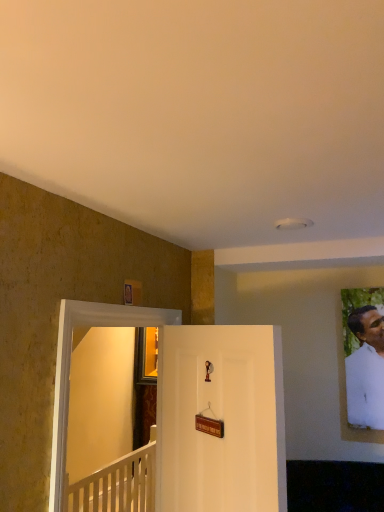
This screenshot has height=512, width=384. What are the coordinates of `white matte door at center` in the screenshot? It's located at (222, 419).

What is the approximate width of white wooden railing at lower left?

3.38 inches.

Where is `transparent glass door at left`? The height and width of the screenshot is (512, 384). transparent glass door at left is located at coordinates (70, 364).

Does white matte door at center appear on the right side of transparent glass door at left?

Correct, you'll find white matte door at center to the right of transparent glass door at left.

Which is closer to the camera, (188, 463) or (129, 318)?

The point (129, 318) is closer to the camera.

From a real-world perspective, is white matte door at center positioned above or below transparent glass door at left?

From a real-world perspective, white matte door at center is physically below transparent glass door at left.

Looking at this image, is white matte door at center behind transparent glass door at left?

Yes, white matte door at center is further from the camera.

Consider the image. From the image's perspective, between white matte portrait at right and white matte door at center, which one is located above?

white matte portrait at right, from the image's perspective.

Is white matte portrait at right surrounding white matte door at center?

No, white matte door at center is located outside of white matte portrait at right.

Looking at this image, from a real-world perspective, is white matte portrait at right positioned above or below white matte door at center?

Clearly, from a real-world perspective, white matte portrait at right is above white matte door at center.

Can you confirm if white matte portrait at right is positioned to the left of white matte door at center?

Incorrect, white matte portrait at right is not on the left side of white matte door at center.

From a real-world perspective, is white matte door at center physically located above or below white matte portrait at right?

white matte door at center is situated lower than white matte portrait at right in the real world.

Is white matte door at center oriented away from white matte portrait at right?

Correct, white matte door at center is looking away from white matte portrait at right.

Identify the location of man above the white matte door at center (from the image's perspective). The height and width of the screenshot is (512, 384). (366, 369).

Can you confirm if white matte door at center is positioned to the right of white matte portrait at right?

No.

Based on their positions, is transparent glass door at left located to the left or right of white matte portrait at right?

From the image, it's evident that transparent glass door at left is to the left of white matte portrait at right.

Is transparent glass door at left next to white matte portrait at right?

They are not placed beside each other.

Locate an element on the screen. The image size is (384, 512). man behind the transparent glass door at left is located at coordinates [x=366, y=369].

Where is `door that appears on the right of white wooden railing at lower left`? door that appears on the right of white wooden railing at lower left is located at coordinates (222, 419).

Does white wooden railing at lower left touch white matte door at center?

No, white wooden railing at lower left is not next to white matte door at center.

Consider the image. Would you say white wooden railing at lower left contains white matte door at center?

No, white matte door at center is not surrounded by white wooden railing at lower left.

Is white wooden railing at lower left bigger than white matte door at center?

Yes.

Does white matte door at center have a greater height compared to white wooden railing at lower left?

Yes, white matte door at center is taller than white wooden railing at lower left.

From a real-world perspective, is white matte door at center on top of white wooden railing at lower left?

Yes, from a real-world perspective, white matte door at center is on top of white wooden railing at lower left.

Which is nearer, (281, 361) or (113, 490)?

Clearly, point (281, 361) is closer to the camera than point (113, 490).

What are the coordinates of `door on the right side of white wooden railing at lower left` in the screenshot? It's located at (222, 419).

Considering the relative sizes of transparent glass door at left and white wooden railing at lower left in the image provided, is transparent glass door at left smaller than white wooden railing at lower left?

Indeed, transparent glass door at left has a smaller size compared to white wooden railing at lower left.

Considering the relative sizes of transparent glass door at left and white wooden railing at lower left in the image provided, is transparent glass door at left thinner than white wooden railing at lower left?

Correct, the width of transparent glass door at left is less than that of white wooden railing at lower left.

Is transparent glass door at left positioned far away from white wooden railing at lower left?

Yes, transparent glass door at left is far from white wooden railing at lower left.

This screenshot has height=512, width=384. Find the location of `door behind the transparent glass door at left`. door behind the transparent glass door at left is located at coordinates (222, 419).

The width and height of the screenshot is (384, 512). Identify the location of door on the left of the white matte portrait at right. (222, 419).

Looking at the image, which one is located closer to transparent glass door at left, white wooden railing at lower left or white matte portrait at right?

Among the two, white matte portrait at right is located nearer to transparent glass door at left.

Looking at this image, from the image, which object appears to be nearer to transparent glass door at left, white matte door at center or white wooden railing at lower left?

white matte door at center is closer to transparent glass door at left.

Based on their spatial positions, is white matte door at center or transparent glass door at left further from white wooden railing at lower left?

The object further to white wooden railing at lower left is transparent glass door at left.

Estimate the real-world distances between objects in this image. Which object is further from white wooden railing at lower left, transparent glass door at left or white matte door at center?

Among the two, transparent glass door at left is located further to white wooden railing at lower left.

Consider the image. Which object lies nearer to the anchor point transparent glass door at left, white wooden railing at lower left or white matte door at center?

white matte door at center is positioned closer to the anchor transparent glass door at left.

Based on their spatial positions, is white matte portrait at right or white wooden railing at lower left closer to white matte door at center?

The object closer to white matte door at center is white matte portrait at right.

Based on their spatial positions, is transparent glass door at left or white matte door at center further from white matte portrait at right?

transparent glass door at left lies further to white matte portrait at right than the other object.

Which object lies nearer to the anchor point white matte portrait at right, white wooden railing at lower left or white matte door at center?

The object closer to white matte portrait at right is white matte door at center.

What are the coordinates of `glass door situated between white wooden railing at lower left and white matte portrait at right from left to right` in the screenshot? It's located at (70, 364).

At what (x,y) coordinates should I click in order to perform the action: click on door between transparent glass door at left and white wooden railing at lower left in the front-back direction. Please return your answer as a coordinate pair (x, y). This screenshot has width=384, height=512. Looking at the image, I should click on (222, 419).

The height and width of the screenshot is (512, 384). What are the coordinates of `door between white wooden railing at lower left and white matte portrait at right in the horizontal direction` in the screenshot? It's located at (222, 419).

Image resolution: width=384 pixels, height=512 pixels. I want to click on door between transparent glass door at left and white matte portrait at right in the horizontal direction, so click(x=222, y=419).